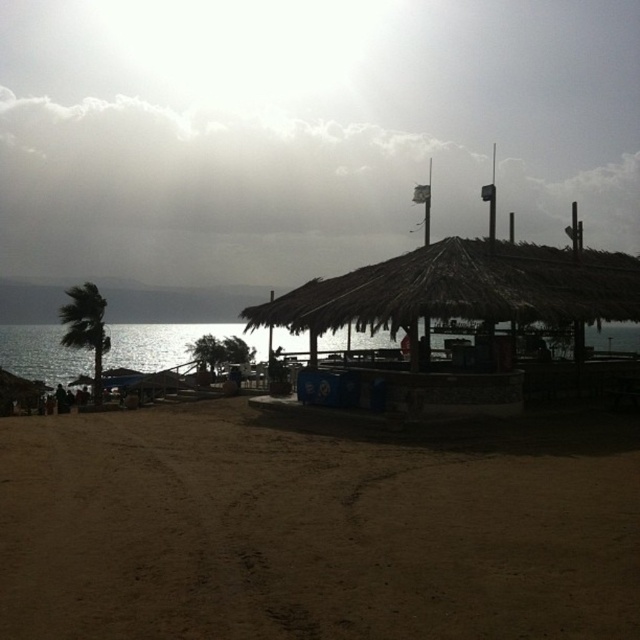
Who is lower down, shiny blue water at lower left or green leafy palm tree at left?

Positioned lower is shiny blue water at lower left.

Who is shorter, shiny blue water at lower left or green leafy palm tree at left?

With less height is shiny blue water at lower left.

Between point (44, 326) and point (96, 401), which one is positioned in front?

Point (96, 401) is in front.

The width and height of the screenshot is (640, 640). What are the coordinates of `shiny blue water at lower left` in the screenshot? It's located at (168, 342).

Which is behind, point (570, 577) or point (74, 344)?

The point (74, 344) is behind.

Who is shorter, brown sandy beach at lower left or green leafy palm tree at left?

Standing shorter between the two is brown sandy beach at lower left.

Who is more distant from viewer, (x=3, y=426) or (x=67, y=320)?

Positioned behind is point (x=67, y=320).

Find the location of a particular element. This screenshot has width=640, height=640. brown sandy beach at lower left is located at coordinates (314, 531).

Does brown sandy beach at lower left appear over shiny blue water at lower left?

No.

Is point (577, 589) farther from viewer compared to point (16, 326)?

That is False.

The width and height of the screenshot is (640, 640). Describe the element at coordinates (314, 531) in the screenshot. I see `brown sandy beach at lower left` at that location.

Identify the location of brown sandy beach at lower left. The image size is (640, 640). (314, 531).